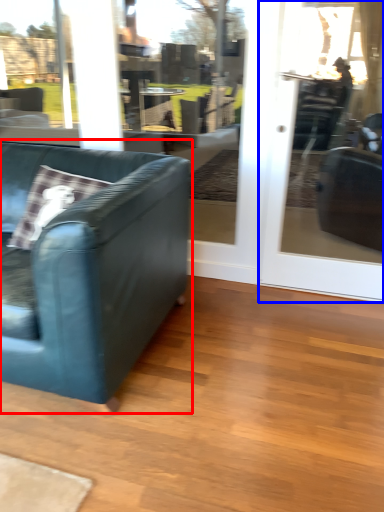
Question: Which object is closer to the camera taking this photo, studio couch (highlighted by a red box) or screen door (highlighted by a blue box)?

Choices:
 (A) studio couch
 (B) screen door

Answer: (A)